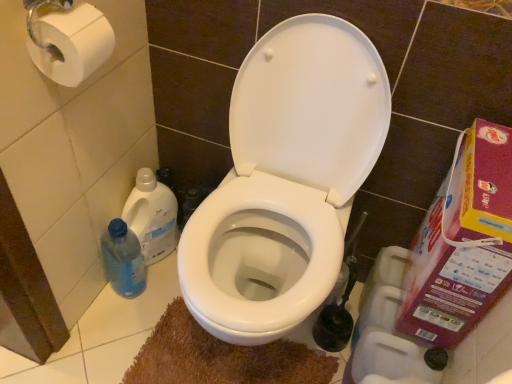
Find the location of `vacant space situated above brown plush bath mat at lower center (from a real-world perspective)`. vacant space situated above brown plush bath mat at lower center (from a real-world perspective) is located at coordinates (220, 361).